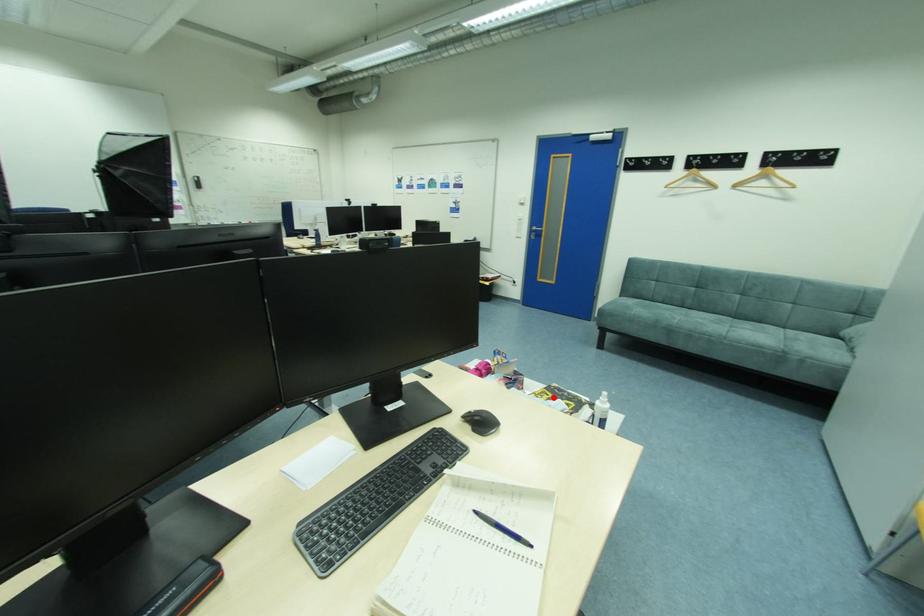
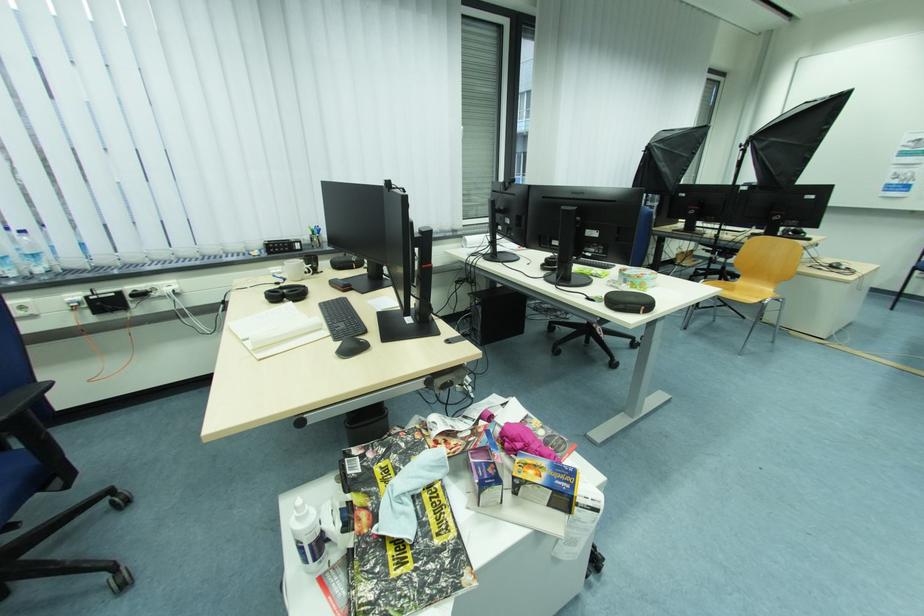
Find the pixel in the second image that matches the highlighted location in the first image.

(442, 530)